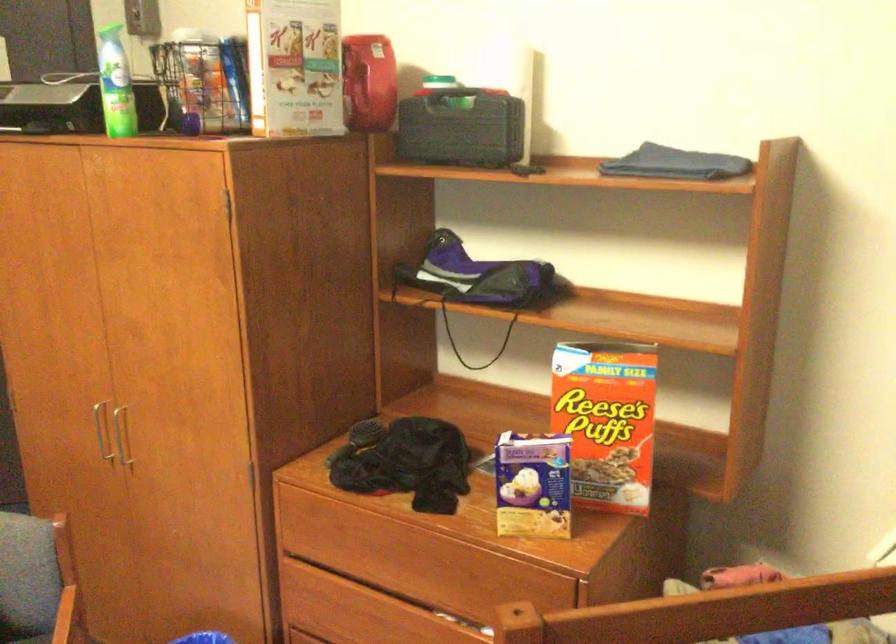
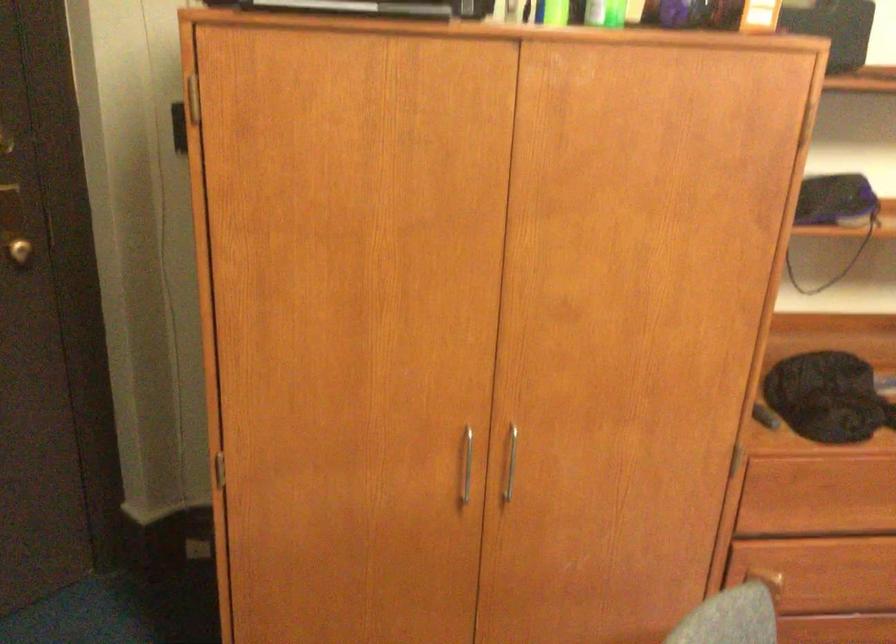
Find the pixel in the second image that matches pixel 113 439 in the first image.

(466, 465)